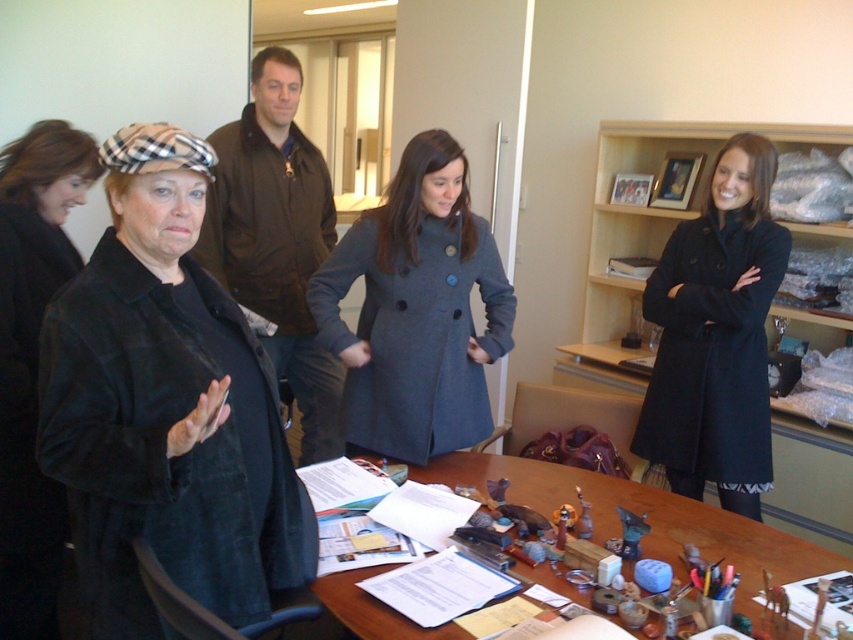
Can you confirm if wooden bookshelf at upper center is taller than brown leather jacket at upper center?

No.

Can you confirm if wooden bookshelf at upper center is wider than brown leather jacket at upper center?

Yes.

Measure the distance between point (x=718, y=147) and camera.

They are 3.53 meters apart.

Identify the location of wooden bookshelf at upper center. (647, 234).

Does point (780, 266) come closer to viewer compared to point (16, 182)?

No.

Measure the distance from black wool coat at right to black velvet coat at center.

black wool coat at right and black velvet coat at center are 6.00 feet apart from each other.

Does point (648, 294) lie in front of point (47, 205)?

No, it is not.

This screenshot has height=640, width=853. Identify the location of black wool coat at right. (717, 336).

Is black suede coat at left positioned at the back of black velvet coat at center?

That is False.

Who is higher up, black suede coat at left or black velvet coat at center?

black suede coat at left is higher up.

The image size is (853, 640). Describe the element at coordinates (166, 410) in the screenshot. I see `black suede coat at left` at that location.

Image resolution: width=853 pixels, height=640 pixels. Identify the location of black suede coat at left. (166, 410).